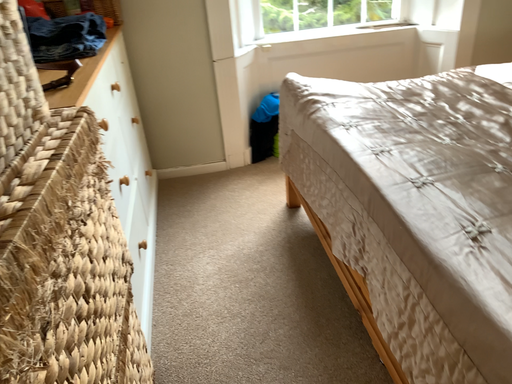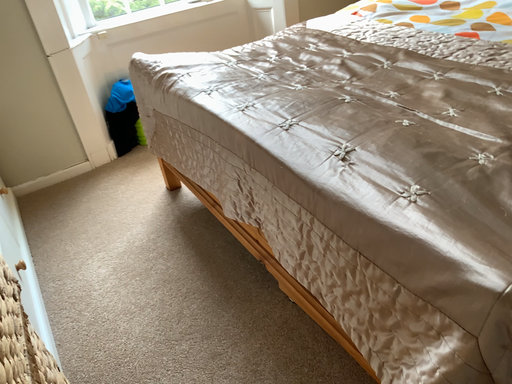
Question: Which way did the camera rotate in the video?

Choices:
 (A) rotated right
 (B) rotated left

Answer: (A)